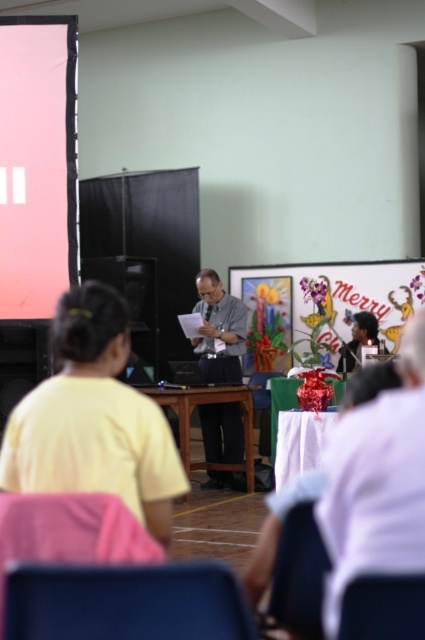
Question: Considering the real-world distances, which object is closest to the matte pink screen at left?

Choices:
 (A) matte blue chair at lower center
 (B) matte black hair at center
 (C) smooth plastic chair at lower center
 (D) gray fabric shirt at center

Answer: (D)

Question: In this image, where is yellow matte shirt at center located relative to white fabric table at center?

Choices:
 (A) above
 (B) below

Answer: (A)

Question: Where is gray fabric shirt at center located in relation to matte black hair at center in the image?

Choices:
 (A) below
 (B) above

Answer: (B)

Question: Is matte blue chair at lower center below wooden chair at center?

Choices:
 (A) yes
 (B) no

Answer: (B)

Question: Among these objects, which one is farthest from the camera?

Choices:
 (A) wooden table at center
 (B) gray fabric shirt at center
 (C) smooth plastic chair at lower center
 (D) wooden chair at center

Answer: (D)

Question: Which point is closer to the camera?

Choices:
 (A) (280, 380)
 (B) (376, 451)

Answer: (B)